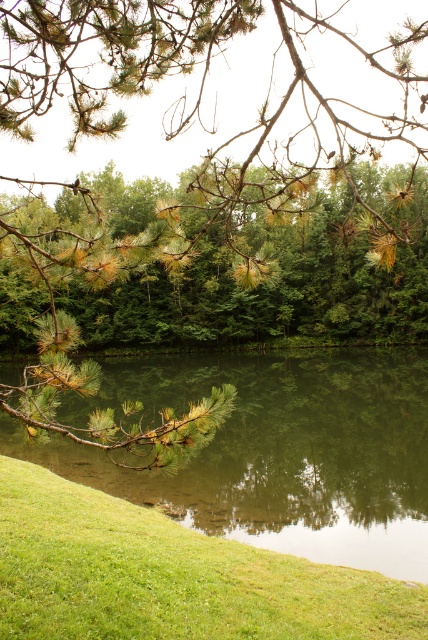
Question: Which point is closer to the camera taking this photo?

Choices:
 (A) (293, 218)
 (B) (410, 500)
 (C) (47, 268)

Answer: (C)

Question: Which of the following is the closest to the observer?

Choices:
 (A) (243, 424)
 (B) (351, 256)
 (C) (58, 532)
 (D) (30, 420)

Answer: (D)

Question: Does green matte pine branch at upper center have a smaller size compared to green needle-like at center?

Choices:
 (A) no
 (B) yes

Answer: (A)

Question: Can you confirm if green matte pine branch at upper center is smaller than green grassy at lower left?

Choices:
 (A) yes
 (B) no

Answer: (B)

Question: Which object appears farthest from the camera in this image?

Choices:
 (A) green grassy at lower left
 (B) green reflective water at lower center

Answer: (A)

Question: Where is green needle-like at center located in relation to green grassy at lower left in the image?

Choices:
 (A) above
 (B) below

Answer: (A)